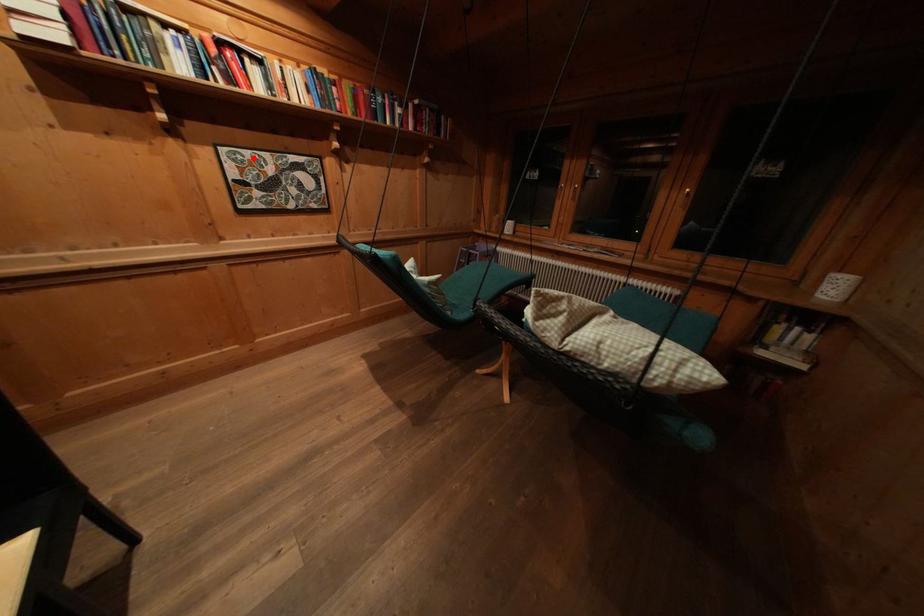
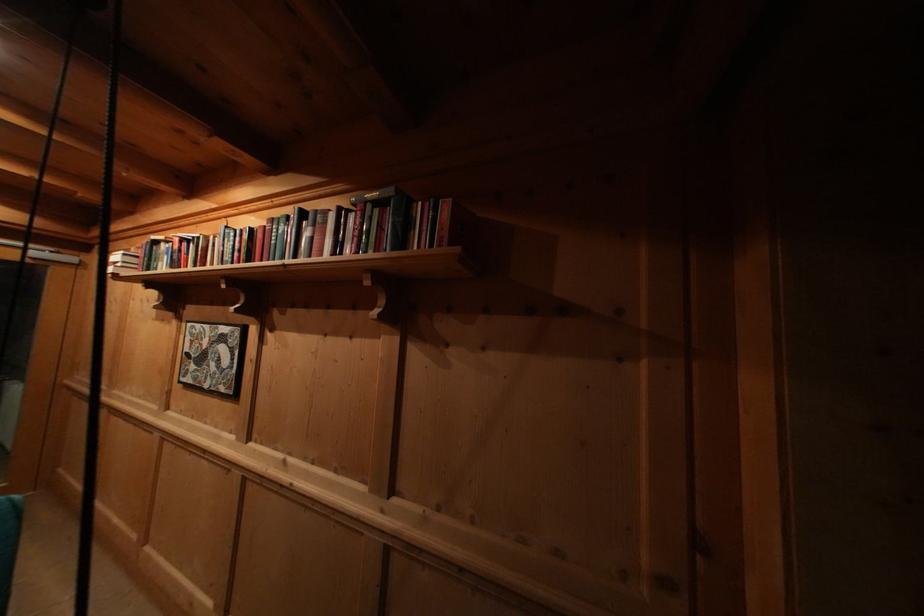
The point at the highlighted location is marked in the first image. Where is the corresponding point in the second image?

(204, 331)